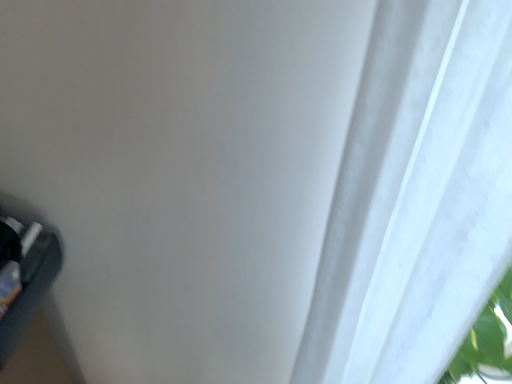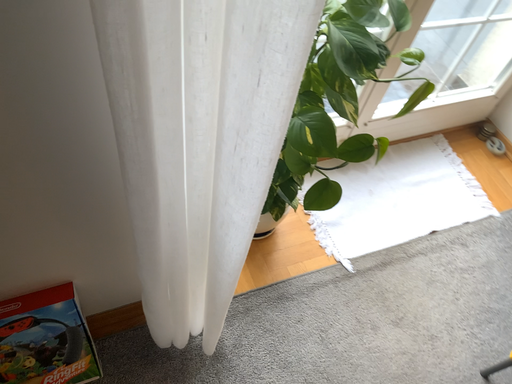
Question: How did the camera likely rotate when shooting the video?

Choices:
 (A) rotated left
 (B) rotated right

Answer: (B)